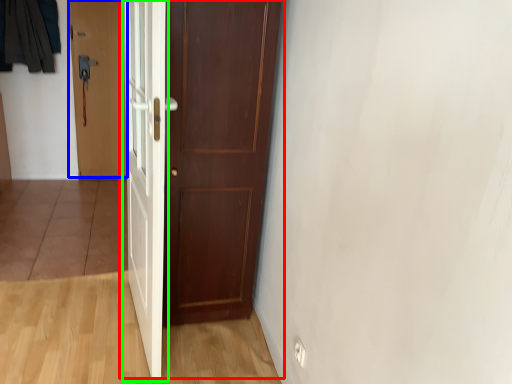
Question: Considering the real-world distances, which object is farthest from door (highlighted by a red box)? door (highlighted by a blue box) or door (highlighted by a green box)?

Choices:
 (A) door
 (B) door

Answer: (A)